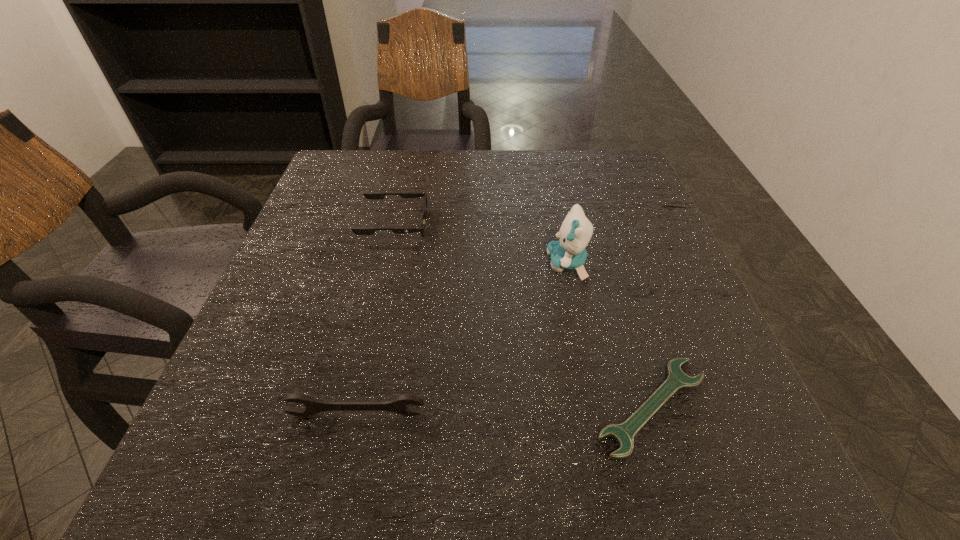
Find the location of a particular element. The width and height of the screenshot is (960, 540). vacant space that satisfies the following two spatial constraints: 1. on the back side of the right wrench; 2. on the face of the second farthest object is located at coordinates (608, 264).

The width and height of the screenshot is (960, 540). Find the location of `free space in the image that satisfies the following two spatial constraints: 1. on the temples of the sunglasses; 2. on the left side of the shortest object`. free space in the image that satisfies the following two spatial constraints: 1. on the temples of the sunglasses; 2. on the left side of the shortest object is located at coordinates (353, 406).